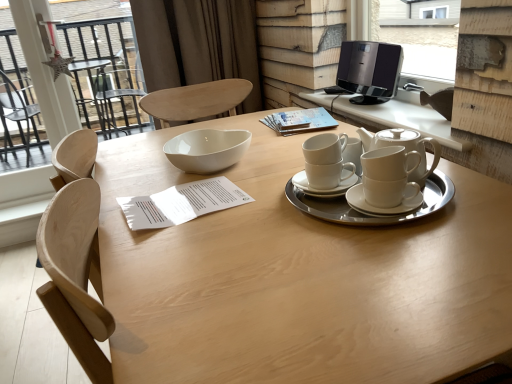
What is the approximate width of white paper at center?

white paper at center is 11.01 inches in width.

The image size is (512, 384). What do you see at coordinates (423, 35) in the screenshot?
I see `black plastic speaker at upper right` at bounding box center [423, 35].

Image resolution: width=512 pixels, height=384 pixels. Describe the element at coordinates (103, 74) in the screenshot. I see `transparent glass door at upper left` at that location.

In order to face white ceramic cups at center, should I rotate leftwards or rightwards?

To align with it, rotate right about 13.791°.

Where is `black glossy speaker at upper right`? black glossy speaker at upper right is located at coordinates (369, 70).

Where is `light wood table at center`? light wood table at center is located at coordinates (298, 278).

Are black plastic speaker at upper right and white ceramic teapot at upper right far apart?

black plastic speaker at upper right is positioned a significant distance from white ceramic teapot at upper right.

Considering the relative sizes of black plastic speaker at upper right and white ceramic teapot at upper right in the image provided, is black plastic speaker at upper right bigger than white ceramic teapot at upper right?

Incorrect, black plastic speaker at upper right is not larger than white ceramic teapot at upper right.

There is a white ceramic teapot at upper right. Where is `window screen above it (from a real-world perspective)`? The image size is (512, 384). window screen above it (from a real-world perspective) is located at coordinates pos(423,35).

Is black plastic speaker at upper right at the left side of white ceramic teapot at upper right?

No.

From a real-world perspective, is white ceramic cups at center located higher than white paper at center?

Actually, white ceramic cups at center is physically below white paper at center in the real world.

Is white ceramic cups at center wider than white paper at center?

Yes, white ceramic cups at center is wider than white paper at center.

Is white ceramic cups at center facing away from white paper at center?

No.

Does point (324, 198) come in front of point (316, 123)?

Yes.

From the image's perspective, would you say black glossy speaker at upper right is shown under white paper at center?

No, from the image's perspective, black glossy speaker at upper right is not beneath white paper at center.

From a real-world perspective, is black glossy speaker at upper right physically below white paper at center?

No.

The height and width of the screenshot is (384, 512). What are the coordinates of `computer monitor behind the white paper at center` in the screenshot? It's located at (369, 70).

Does black glossy speaker at upper right turn towards light wood table at center?

No.

Is black glossy speaker at upper right far from light wood table at center?

No, black glossy speaker at upper right is in close proximity to light wood table at center.

Looking at this image, from the image's perspective, does black glossy speaker at upper right appear higher than light wood table at center?

Indeed, from the image's perspective, black glossy speaker at upper right is shown above light wood table at center.

Which of these two, white ceramic cups at center or white ceramic teapot at upper right, stands taller?

white ceramic teapot at upper right.

Is point (345, 218) less distant than point (413, 173)?

Yes, point (345, 218) is closer to viewer.

Is white ceramic cups at center positioned with its back to white ceramic teapot at upper right?

Yes.

Is white ceramic teapot at upper right completely or partially inside white ceramic cups at center?

Actually, white ceramic teapot at upper right is outside white ceramic cups at center.

Can you confirm if black glossy speaker at upper right is smaller than transparent glass door at upper left?

Yes.

Does black glossy speaker at upper right have a lesser width compared to transparent glass door at upper left?

No.

What's the angular difference between black glossy speaker at upper right and transparent glass door at upper left's facing directions?

They differ by 89.1 degrees in their facing directions.

Is black glossy speaker at upper right next to transparent glass door at upper left and touching it?

No, black glossy speaker at upper right is not next to transparent glass door at upper left.

Can you see black plastic speaker at upper right touching white ceramic teapot at upper right?

No, black plastic speaker at upper right is not next to white ceramic teapot at upper right.

How different are the orientations of black plastic speaker at upper right and white ceramic teapot at upper right in degrees?

0.299 degrees separate the facing orientations of black plastic speaker at upper right and white ceramic teapot at upper right.

Which object is thinner, black plastic speaker at upper right or white ceramic teapot at upper right?

Thinner between the two is black plastic speaker at upper right.

Who is taller, black plastic speaker at upper right or white ceramic teapot at upper right?

With more height is black plastic speaker at upper right.

You are a GUI agent. You are given a task and a screenshot of the screen. Output one action in this format:
    pyautogui.click(x=<x>, y=<y>)
    Task: Click on the window screen behind the white ceramic teapot at upper right
    This screenshot has width=512, height=384.
    Given the screenshot: What is the action you would take?
    pyautogui.click(x=423, y=35)

Where is `tableware below the white paper at center (from a real-world perspective)`? The image size is (512, 384). tableware below the white paper at center (from a real-world perspective) is located at coordinates (358, 213).

When comparing their distances from black glossy speaker at upper right, does black plastic speaker at upper right or white ceramic cups at center seem closer?

white ceramic cups at center lies closer to black glossy speaker at upper right than the other object.

Which object lies further to the anchor point white ceramic cups at center, black plastic speaker at upper right or transparent glass door at upper left?

black plastic speaker at upper right.

Looking at the image, which one is located further to brown fabric curtain at upper center, white ceramic teapot at upper right or black plastic speaker at upper right?

The object further to brown fabric curtain at upper center is white ceramic teapot at upper right.

Which object lies further to the anchor point white ceramic teapot at upper right, white ceramic cups at center or black glossy speaker at upper right?

black glossy speaker at upper right is positioned further to the anchor white ceramic teapot at upper right.

Looking at the image, which one is located closer to light wood table at center, brown fabric curtain at upper center or black plastic speaker at upper right?

brown fabric curtain at upper center.

Looking at the image, which one is located closer to black glossy speaker at upper right, light wood table at center or white paper at center?

white paper at center.

Looking at the image, which one is located closer to light wood table at center, black plastic speaker at upper right or brown fabric curtain at upper center?

Among the two, brown fabric curtain at upper center is located nearer to light wood table at center.

When comparing their distances from white paper at center, does transparent glass door at upper left or white ceramic cups at center seem closer?

The object closer to white paper at center is white ceramic cups at center.

This screenshot has width=512, height=384. In order to click on teapot positioned between light wood table at center and brown fabric curtain at upper center from near to far in this screenshot , I will do `click(405, 148)`.

Where is `tableware between transparent glass door at upper left and white ceramic teapot at upper right in the horizontal direction`? tableware between transparent glass door at upper left and white ceramic teapot at upper right in the horizontal direction is located at coordinates [358, 213].

Locate an element on the screen. curtain between transparent glass door at upper left and black glossy speaker at upper right is located at coordinates click(x=198, y=44).

The image size is (512, 384). Find the location of `notepad between white ceramic teapot at upper right and brown fabric curtain at upper center along the z-axis`. notepad between white ceramic teapot at upper right and brown fabric curtain at upper center along the z-axis is located at coordinates (298, 121).